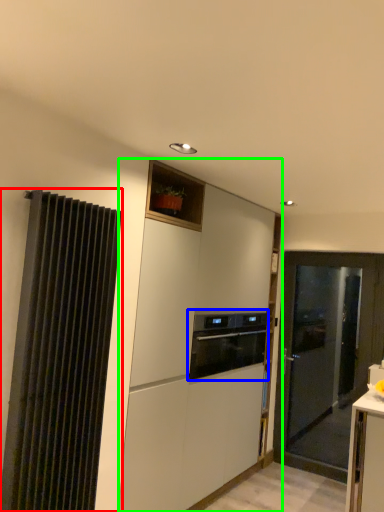
Question: Estimate the real-world distances between objects in this image. Which object is closer to curtain (highlighted by a red box), home appliance (highlighted by a blue box) or cabinetry (highlighted by a green box)?

Choices:
 (A) home appliance
 (B) cabinetry

Answer: (B)